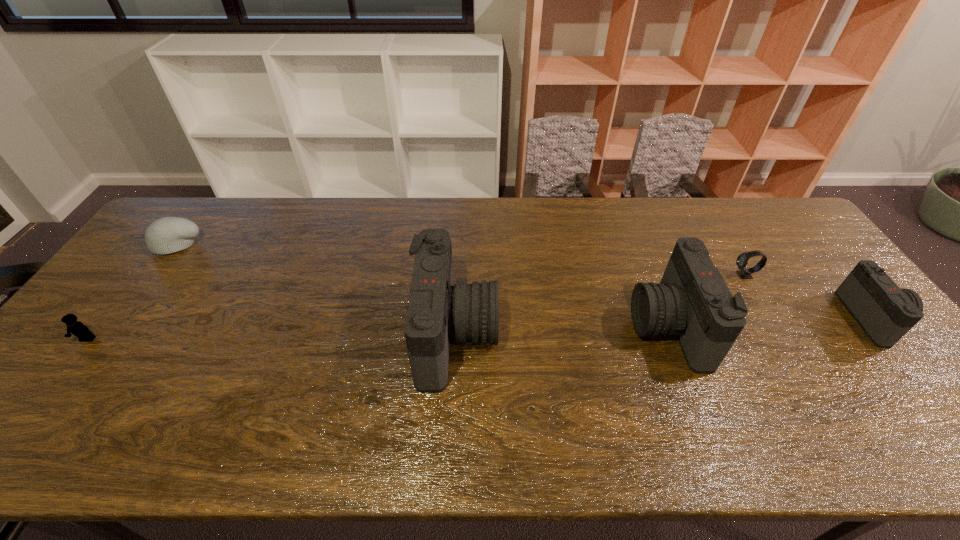
The image size is (960, 540). Identify the location of vacant area that lies between the rightmost camera and the farthest object. (525, 281).

This screenshot has height=540, width=960. I want to click on vacant area that lies between the farthest object and the Lego, so click(x=132, y=292).

Identify the location of free space that is in between the beanie and the watch. This screenshot has height=540, width=960. (461, 260).

Image resolution: width=960 pixels, height=540 pixels. I want to click on empty space that is in between the rightmost camera and the watch, so click(x=808, y=296).

You are a GUI agent. You are given a task and a screenshot of the screen. Output one action in this format:
    pyautogui.click(x=<x>, y=<y>)
    Task: Click on the vacant space that is in between the shortest camera and the beanie
    This screenshot has width=960, height=540.
    Given the screenshot: What is the action you would take?
    pyautogui.click(x=525, y=281)

Where is `free space between the fourth object from right to left and the second farthest object`? free space between the fourth object from right to left and the second farthest object is located at coordinates (600, 305).

The image size is (960, 540). In order to click on vacant space that is in between the third object from left to right and the Lego in this screenshot , I will do `click(272, 337)`.

Select which object is the closest to the shortest camera. Please provide its 2D coordinates. Your answer should be formatted as a tuple, i.e. [(x, y)], where the tuple contains the x and y coordinates of a point satisfying the conditions above.

[(744, 273)]

This screenshot has width=960, height=540. What are the coordinates of `object that can be found as the second closest to the third tallest object` in the screenshot? It's located at (692, 302).

Locate an element on the screen. The height and width of the screenshot is (540, 960). the second closest camera to the second tallest object is located at coordinates (885, 312).